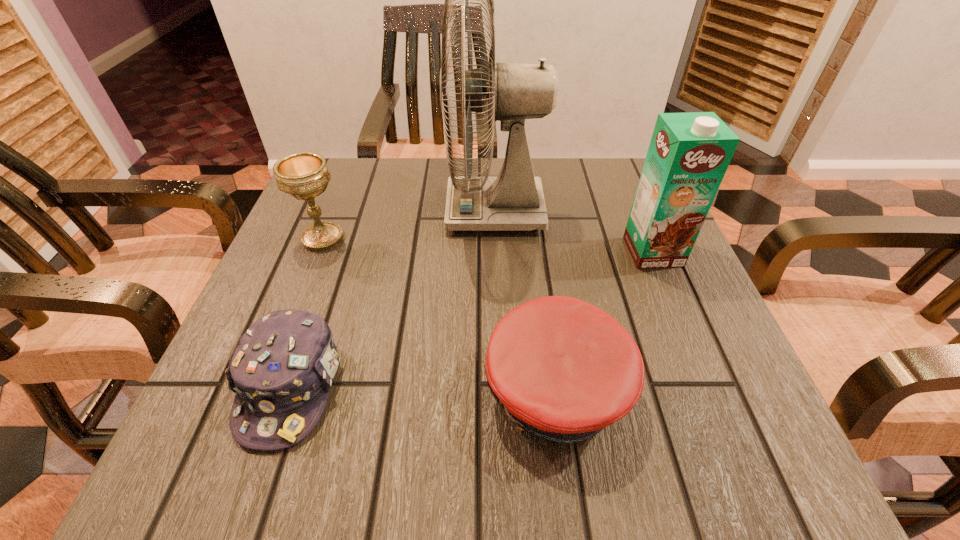
You are a GUI agent. You are given a task and a screenshot of the screen. Output one action in this format:
    pyautogui.click(x=<x>, y=<y>)
    Task: Click on the fan
    
    Given the screenshot: What is the action you would take?
    pyautogui.click(x=513, y=201)

Find the location of a particular element. The image size is (960, 540). the rightmost object is located at coordinates point(689,153).

The image size is (960, 540). Identify the location of the fourth shortest object. tap(689, 153).

Find the location of a particular element. This screenshot has height=540, width=960. the third shortest object is located at coordinates (303, 175).

Where is `the right headwear`? The height and width of the screenshot is (540, 960). the right headwear is located at coordinates (563, 369).

Find the location of `the left headwear`. the left headwear is located at coordinates (281, 371).

Where is `free location located 0.150m on the front-facing side of the tallest object`? The width and height of the screenshot is (960, 540). free location located 0.150m on the front-facing side of the tallest object is located at coordinates (377, 211).

Image resolution: width=960 pixels, height=540 pixels. I want to click on free region located 0.280m on the front-facing side of the tallest object, so click(318, 211).

Find the location of `vacant area located on the front-facing side of the tallest object`. vacant area located on the front-facing side of the tallest object is located at coordinates (382, 211).

I want to click on vacant space located on the front of the rightmost object, so [x=668, y=288].